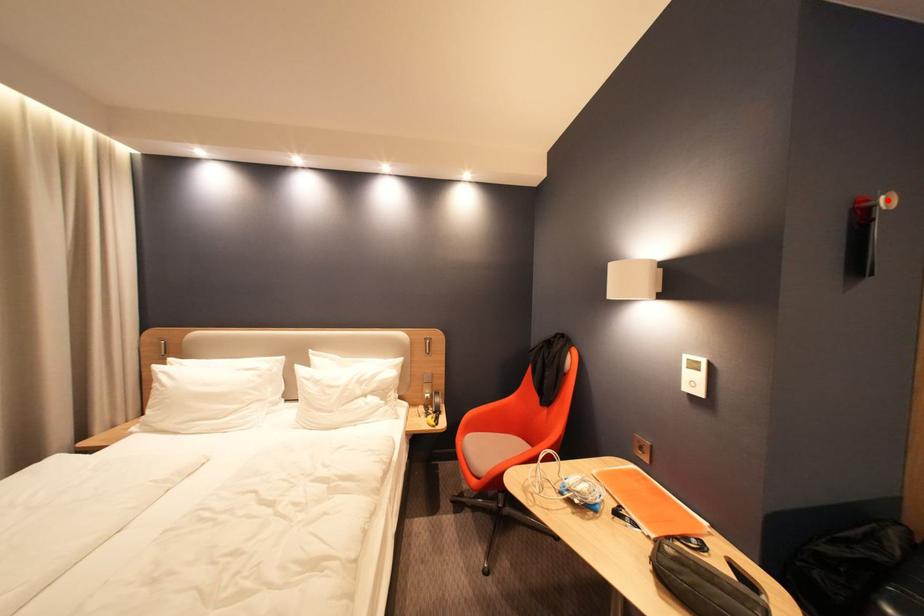
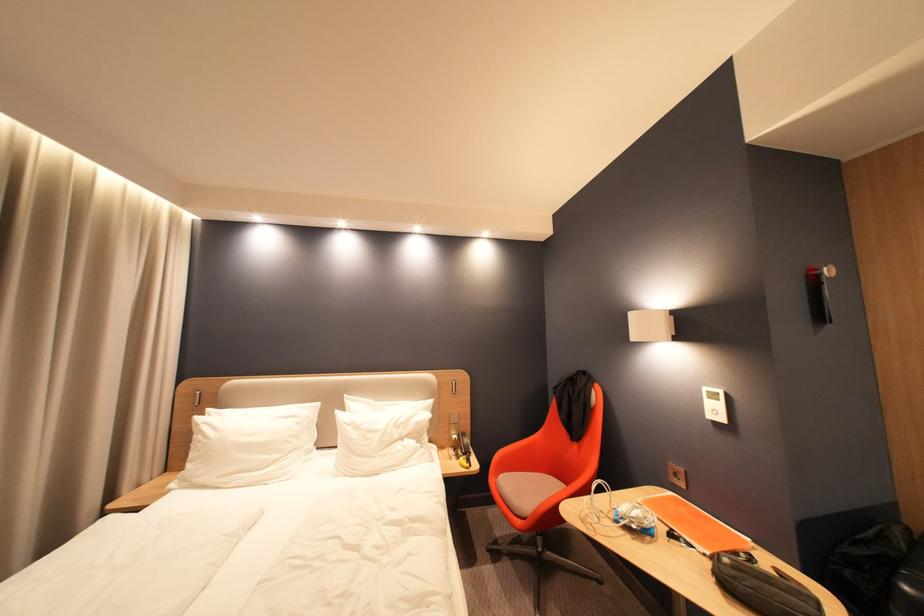
Question: I am providing you with two images of the same scene from different viewpoints. A red point is marked on the first image. Is the red point's position out of view in image 2?

Choices:
 (A) Yes
 (B) No

Answer: (B)